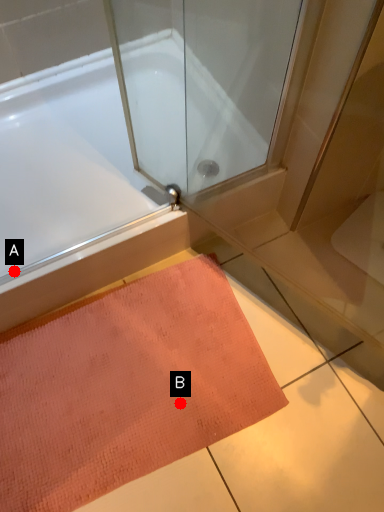
Question: Two points are circled on the image, labeled by A and B beside each circle. Which point is closer to the camera taking this photo?

Choices:
 (A) A is closer
 (B) B is closer

Answer: (A)